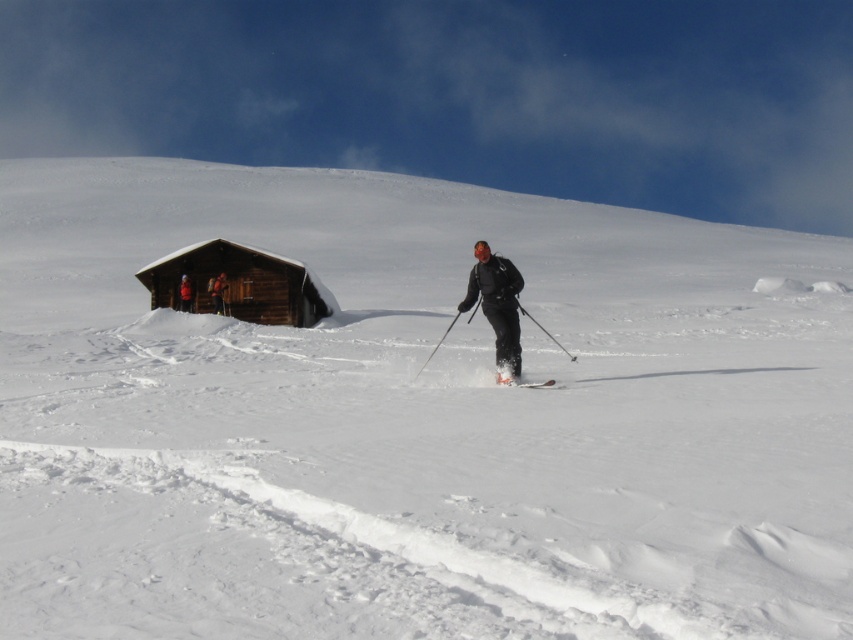
Question: Can you confirm if matte black ski suit at center is positioned to the left of orange fabric jacket at left?

Choices:
 (A) yes
 (B) no

Answer: (B)

Question: Can you confirm if brown wooden log cabin at upper left is thinner than matte black ski suit at center?

Choices:
 (A) no
 (B) yes

Answer: (A)

Question: Among these points, which one is nearest to the camera?

Choices:
 (A) (224, 312)
 (B) (184, 278)
 (C) (233, 300)

Answer: (A)

Question: Which point is closer to the camera?

Choices:
 (A) brown wooden log cabin at upper left
 (B) orange fabric jacket at left

Answer: (B)

Question: Among these objects, which one is nearest to the camera?

Choices:
 (A) orange fabric jacket at left
 (B) matte black ski suit at center
 (C) white matte ski at center

Answer: (C)

Question: Is brown wooden log cabin at upper left above matte black ski suit at center?

Choices:
 (A) no
 (B) yes

Answer: (B)